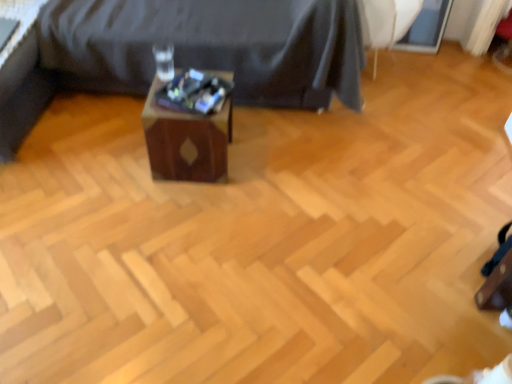
Find the location of a particular element. This screenshot has width=512, height=384. vacant area that lies between wooden box at center and wooden side table at center is located at coordinates (229, 139).